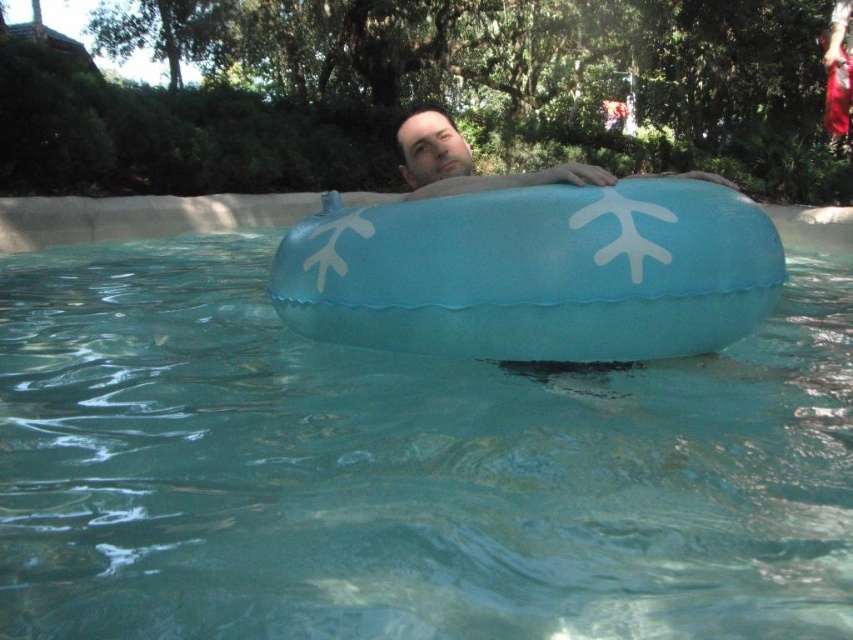
Question: Which object appears farthest from the camera in this image?

Choices:
 (A) matte blue float at center
 (B) blue rubber ring at center

Answer: (A)

Question: Among these objects, which one is nearest to the camera?

Choices:
 (A) matte blue float at center
 (B) blue rubber ring at center

Answer: (B)

Question: Can you confirm if blue rubber ring at center is wider than matte blue float at center?

Choices:
 (A) yes
 (B) no

Answer: (A)

Question: Is blue rubber ring at center below matte blue float at center?

Choices:
 (A) no
 (B) yes

Answer: (B)

Question: Can you confirm if blue rubber ring at center is wider than matte blue float at center?

Choices:
 (A) yes
 (B) no

Answer: (A)